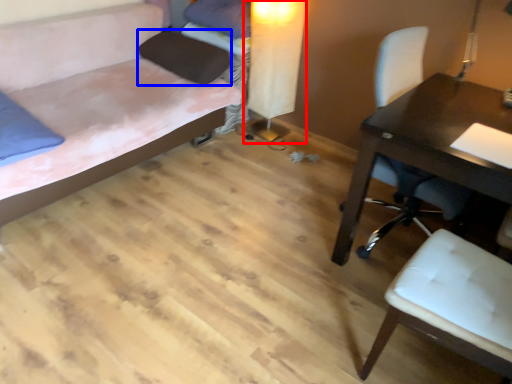
Question: Which of the following is the farthest to the observer, table lamp (highlighted by a red box) or pillow (highlighted by a blue box)?

Choices:
 (A) table lamp
 (B) pillow

Answer: (B)